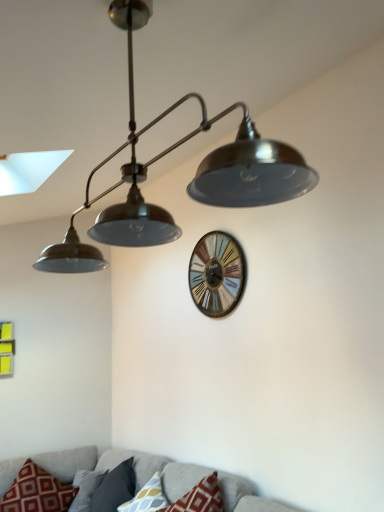
Question: Is red printed cushion at lower left, the third pillow viewed from the right, far from textured gray couch at lower center?

Choices:
 (A) no
 (B) yes

Answer: (A)

Question: Is red printed cushion at lower left, the 1th pillow in the left-to-right sequence, oriented away from textured gray couch at lower center?

Choices:
 (A) yes
 (B) no

Answer: (A)

Question: Is textured gray couch at lower center located within red printed cushion at lower left, the third pillow viewed from the right?

Choices:
 (A) no
 (B) yes

Answer: (A)

Question: From a real-world perspective, is red printed cushion at lower left, the third pillow viewed from the right, below textured gray couch at lower center?

Choices:
 (A) yes
 (B) no

Answer: (B)

Question: Is red printed cushion at lower left, the third pillow viewed from the right, with textured gray couch at lower center?

Choices:
 (A) no
 (B) yes

Answer: (A)

Question: Is red printed cushion at lower left, the third pillow viewed from the right, shorter than textured gray couch at lower center?

Choices:
 (A) yes
 (B) no

Answer: (A)

Question: Are gray fabric pillow at lower center, which ranks as the 2th pillow in right-to-left order, and patterned fabric pillow at lower center, placed as the 3th pillow when sorted from left to right, far apart?

Choices:
 (A) no
 (B) yes

Answer: (A)

Question: Is gray fabric pillow at lower center, which is counted as the 2th pillow, starting from the left, smaller than patterned fabric pillow at lower center, placed as the 3th pillow when sorted from left to right?

Choices:
 (A) no
 (B) yes

Answer: (A)

Question: Considering the relative sizes of gray fabric pillow at lower center, which is counted as the 2th pillow, starting from the left, and patterned fabric pillow at lower center, placed as the 3th pillow when sorted from left to right, in the image provided, is gray fabric pillow at lower center, which is counted as the 2th pillow, starting from the left, taller than patterned fabric pillow at lower center, placed as the 3th pillow when sorted from left to right,?

Choices:
 (A) yes
 (B) no

Answer: (A)

Question: Can you confirm if gray fabric pillow at lower center, which is counted as the 2th pillow, starting from the left, is bigger than patterned fabric pillow at lower center, placed as the 3th pillow when sorted from left to right?

Choices:
 (A) no
 (B) yes

Answer: (B)

Question: From the image's perspective, is gray fabric pillow at lower center, which ranks as the 2th pillow in right-to-left order, on patterned fabric pillow at lower center, placed as the 1th pillow when sorted from right to left?

Choices:
 (A) yes
 (B) no

Answer: (B)

Question: Is gray fabric pillow at lower center, which is counted as the 2th pillow, starting from the left, closer to camera compared to patterned fabric pillow at lower center, placed as the 3th pillow when sorted from left to right?

Choices:
 (A) yes
 (B) no

Answer: (B)

Question: Does textured gray couch at lower center have a smaller size compared to wooden wall clock at center?

Choices:
 (A) yes
 (B) no

Answer: (B)